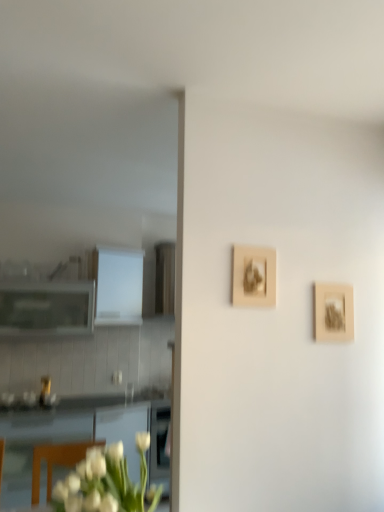
Question: Relative to white matte flower at lower left, is white glossy cabinet at left, acting as the first cabinetry starting from the right, in front or behind?

Choices:
 (A) behind
 (B) front

Answer: (A)

Question: Is white glossy cabinet at left, which appears as the 2th cabinetry when viewed from the left, inside or outside of white matte flower at lower left?

Choices:
 (A) inside
 (B) outside

Answer: (B)

Question: Considering the real-world distances, which object is farthest from the beige textured frame at upper center, placed as the second picture frame when sorted from right to left?

Choices:
 (A) white glossy cabinet at left, acting as the first cabinetry starting from the right
 (B) white matte flower at lower left
 (C) matte white cabinet at left, marked as the 1th cabinetry in a left-to-right arrangement
 (D) wooden frame at right, the 2th picture frame in the front-to-back sequence

Answer: (C)

Question: Which object is positioned farthest from the beige textured frame at upper center, which is the second picture frame in back-to-front order?

Choices:
 (A) wooden frame at right, the first picture frame from the back
 (B) white glossy cabinet at left, which appears as the 2th cabinetry when viewed from the left
 (C) matte white cabinet at left, marked as the 1th cabinetry in a left-to-right arrangement
 (D) white matte flower at lower left

Answer: (C)